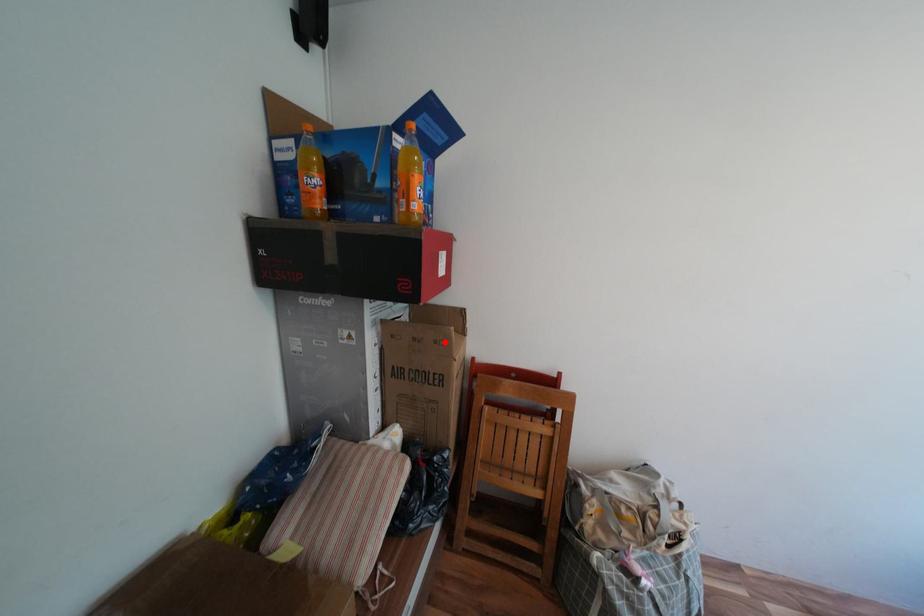
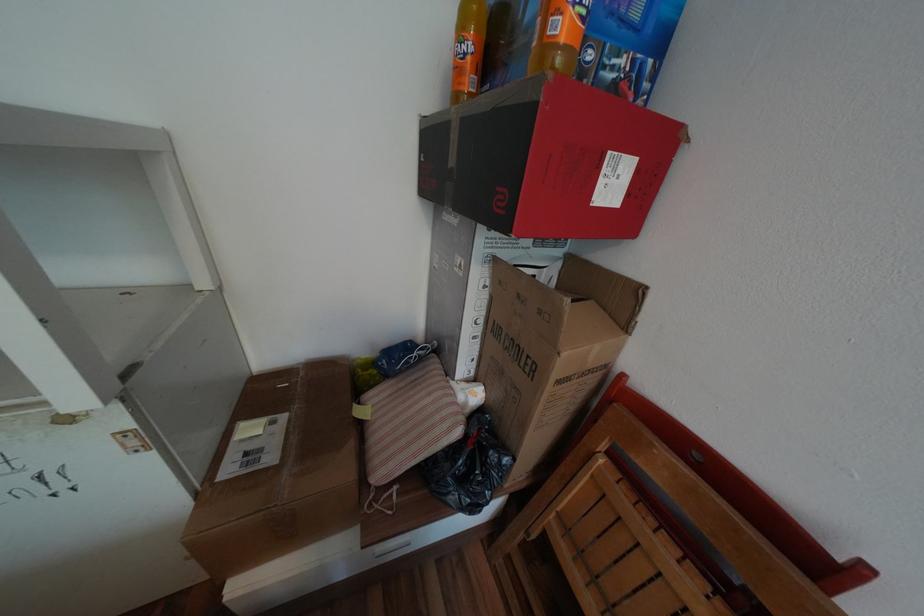
Locate, in the second image, the point that corresponds to the highlighted location in the first image.

(550, 312)